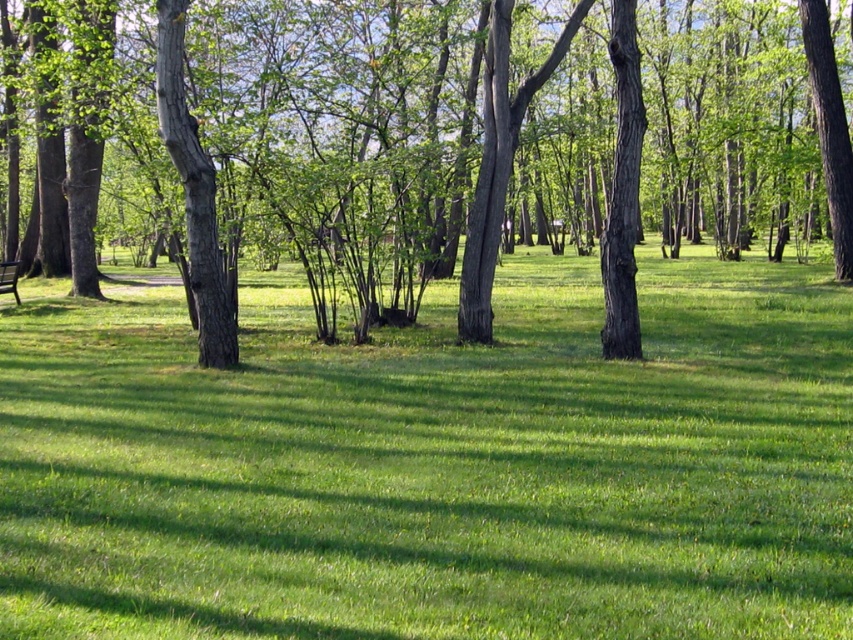
You are planning to set up a picnic blanket in the park. The picnic blanket is 2 meters wide. You see the green grassy at center and the brown rough tree at center. Which area can accommodate the blanket without folding it?

The brown rough tree at center has a greater width than the green grassy at center, so the picnic blanket can fit on the area near the brown rough tree at center since it is wider.

You are standing at the point with coordinates (434,464) in the park. What is the terrain like under your feet?

The terrain at point (434,464) is green grassy at center, so it is soft and even under your feet.

You are standing in the park and want to take a photo of the green grassy at center and the brown rough tree at center. Which object will appear larger in your photo?

The green grassy at center will appear larger in your photo because it is closer to the viewer than the brown rough tree at center.